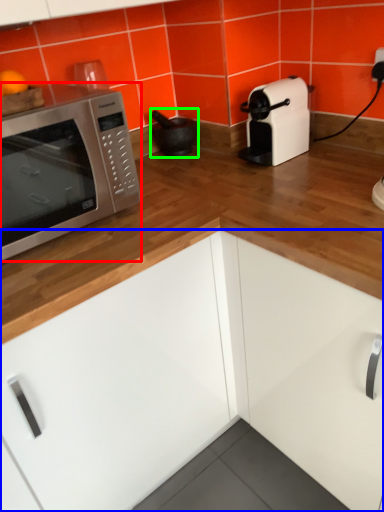
Question: Based on their relative distances, which object is farther from microwave oven (highlighted by a red box)? Choose from cabinetry (highlighted by a blue box) and appliance (highlighted by a green box).

Choices:
 (A) cabinetry
 (B) appliance

Answer: (B)